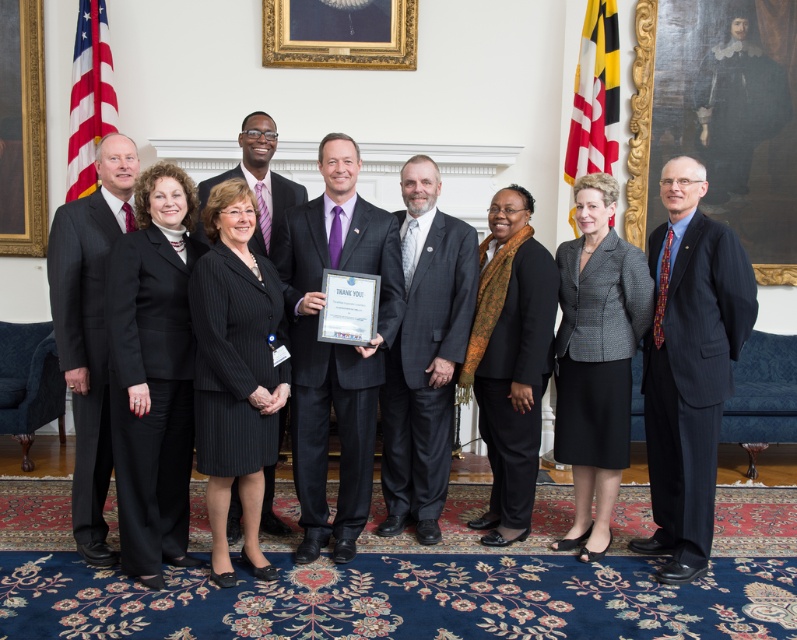
This screenshot has width=797, height=640. What do you see at coordinates (22, 129) in the screenshot?
I see `wooden picture frame at upper left` at bounding box center [22, 129].

Between wooden picture frame at upper left and red fabric flag at upper right, which one is positioned higher?

wooden picture frame at upper left is above.

Is point (22, 141) closer to viewer compared to point (587, 129)?

No, (22, 141) is further to viewer.

Locate an element on the screen. The height and width of the screenshot is (640, 797). wooden picture frame at upper left is located at coordinates (22, 129).

Between dark blue pinstripe suit at right and matte american flag at left, which one is positioned higher?

matte american flag at left is higher up.

Looking at this image, is dark blue pinstripe suit at right to the right of matte american flag at left from the viewer's perspective?

Yes, dark blue pinstripe suit at right is to the right of matte american flag at left.

The width and height of the screenshot is (797, 640). Describe the element at coordinates (689, 365) in the screenshot. I see `dark blue pinstripe suit at right` at that location.

Locate an element on the screen. dark blue pinstripe suit at right is located at coordinates (689, 365).

Does point (2, 221) come in front of point (89, 176)?

No, it is not.

Who is higher up, wooden picture frame at upper left or matte american flag at left?

Positioned higher is matte american flag at left.

The height and width of the screenshot is (640, 797). Identify the location of wooden picture frame at upper left. (22, 129).

You are a GUI agent. You are given a task and a screenshot of the screen. Output one action in this format:
    pyautogui.click(x=<x>, y=<y>)
    Task: Click on the wooden picture frame at upper left
    The height and width of the screenshot is (640, 797).
    Given the screenshot: What is the action you would take?
    pyautogui.click(x=22, y=129)